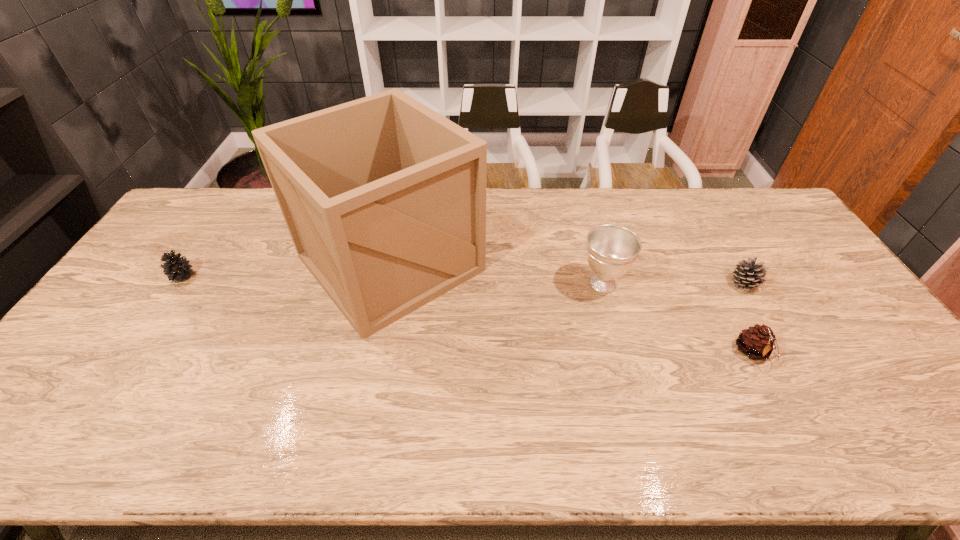
Image resolution: width=960 pixels, height=540 pixels. Find the location of `object present at the far edge`. object present at the far edge is located at coordinates (385, 199).

Find the location of a particular element. This screenshot has height=540, width=960. object at the left edge is located at coordinates (177, 268).

This screenshot has height=540, width=960. What are the coordinates of `blank space at the far edge` in the screenshot? It's located at (575, 193).

Locate an element on the screen. vacant space at the near edge of the desktop is located at coordinates point(154,456).

This screenshot has width=960, height=540. I want to click on vacant space at the far left corner of the desktop, so click(195, 225).

Where is `free space at the far right corner`? free space at the far right corner is located at coordinates (765, 202).

Locate an element on the screen. free spot between the box and the leftmost pinecone is located at coordinates (286, 269).

This screenshot has width=960, height=540. I want to click on vacant area that lies between the nearest pinecone and the second tallest object, so click(678, 319).

This screenshot has height=540, width=960. I want to click on free point between the box and the leftmost pinecone, so click(286, 269).

What are the coordinates of `vacant space in between the nearest pinecone and the box` in the screenshot? It's located at (571, 308).